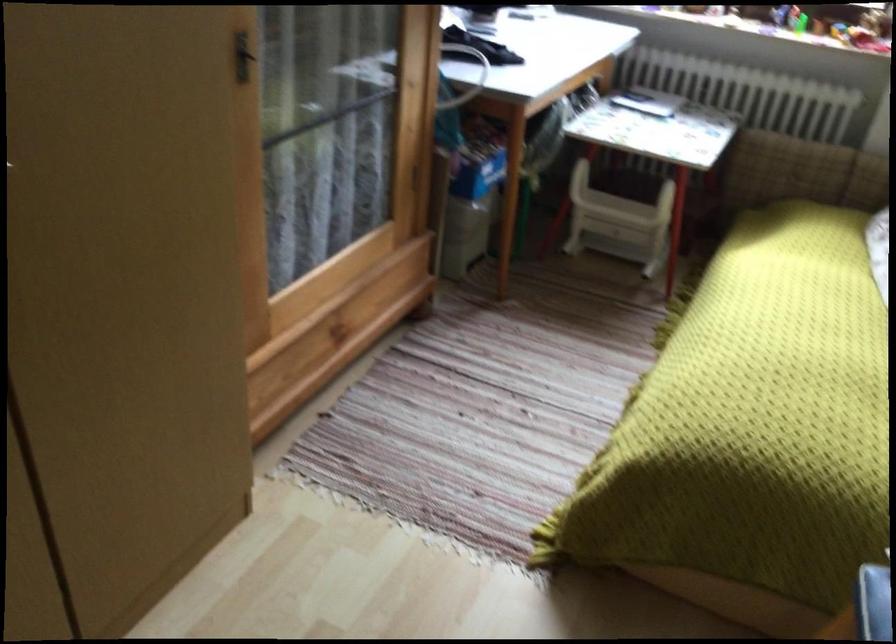
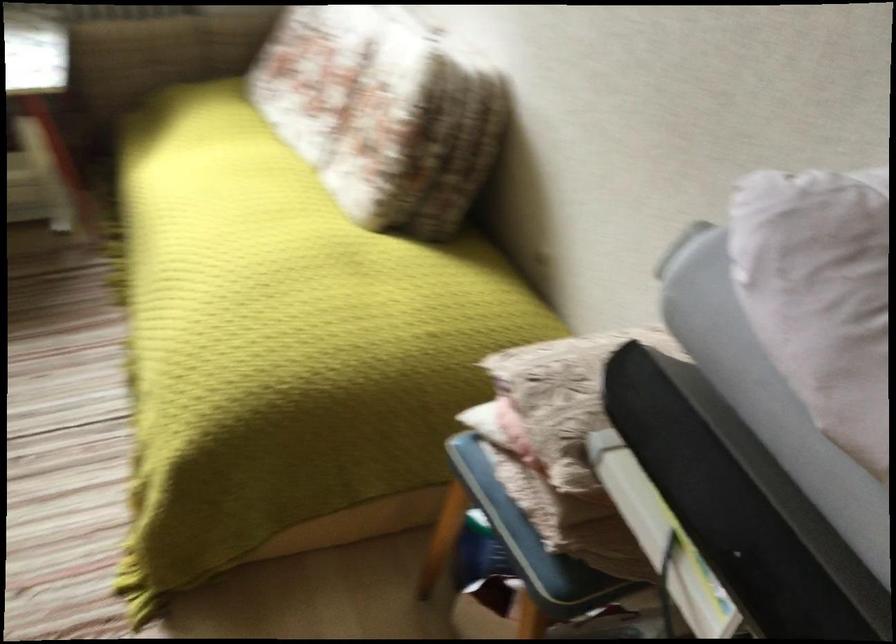
In the second image, find the point that corresponds to [789,406] in the first image.

(290, 314)